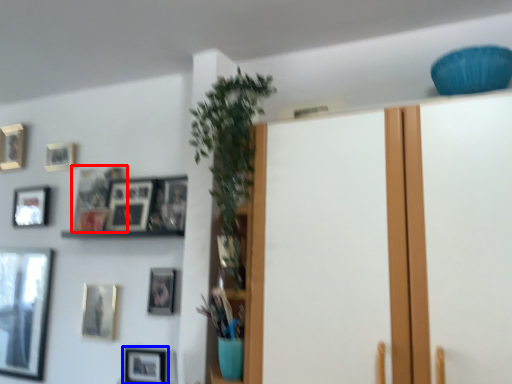
Question: Which object is further to the camera taking this photo, picture frame (highlighted by a red box) or picture frame (highlighted by a blue box)?

Choices:
 (A) picture frame
 (B) picture frame

Answer: (A)